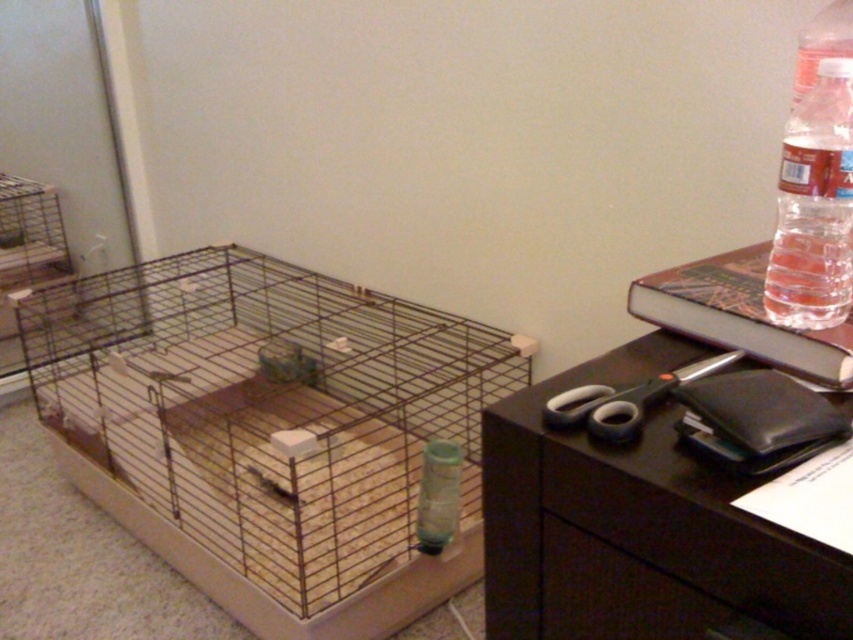
Who is more forward, (576, 634) or (834, 40)?

Point (576, 634)

Is brown matte drawer at lower right closer to the viewer compared to clear plastic bottle at upper right?

Yes, it is.

Image resolution: width=853 pixels, height=640 pixels. What do you see at coordinates (674, 561) in the screenshot? I see `brown matte drawer at lower right` at bounding box center [674, 561].

You are a GUI agent. You are given a task and a screenshot of the screen. Output one action in this format:
    pyautogui.click(x=<x>, y=<y>)
    Task: Click on the brown matte drawer at lower right
    This screenshot has height=640, width=853.
    Given the screenshot: What is the action you would take?
    pyautogui.click(x=674, y=561)

Does brown wire bird cage at center have a greater width compared to clear plastic bottle at upper right?

Yes, brown wire bird cage at center is wider than clear plastic bottle at upper right.

Between brown wire bird cage at center and clear plastic bottle at upper right, which one has more height?

brown wire bird cage at center is taller.

Between point (287, 444) and point (843, 17), which one is positioned behind?

Point (287, 444)

Image resolution: width=853 pixels, height=640 pixels. In order to click on brown wire bird cage at center in this screenshot , I will do `click(270, 429)`.

Does point (695, 595) come closer to viewer compared to point (849, 1)?

That is True.

Between point (798, 536) and point (834, 45), which one is positioned behind?

The point (834, 45) is more distant.

At what (x,y) coordinates should I click in order to perform the action: click on black matte computer desk at right. Please return your answer as a coordinate pair (x, y). Looking at the image, I should click on pos(636,524).